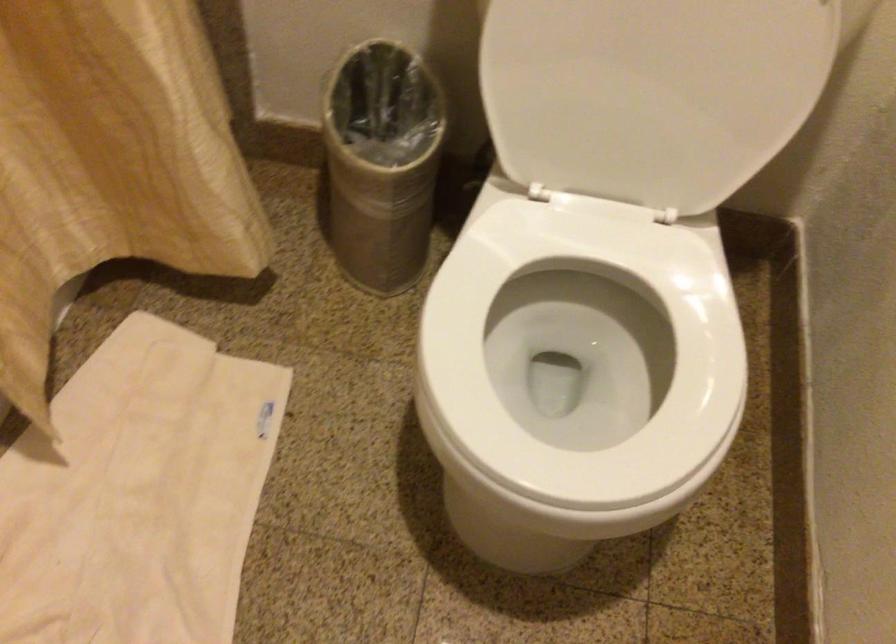
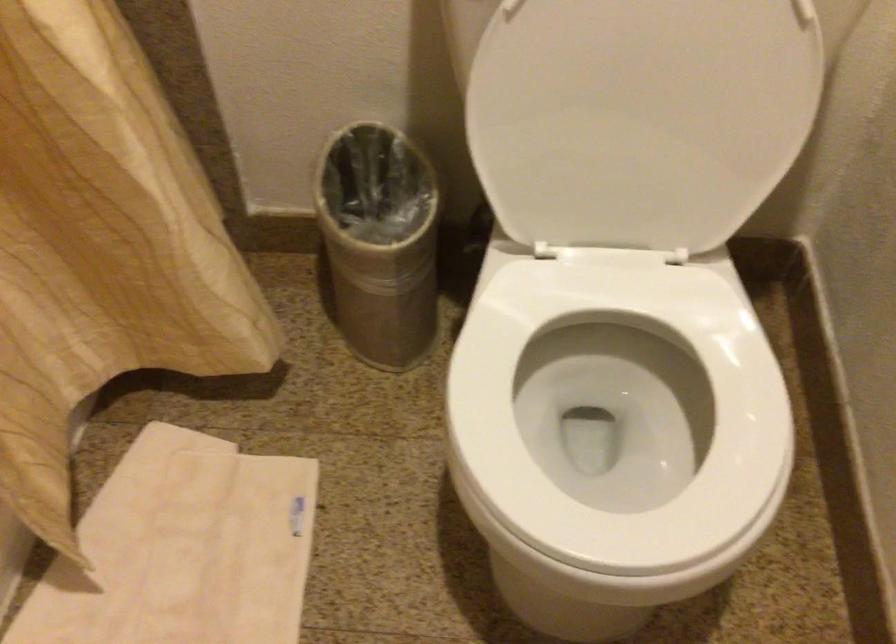
Where in the second image is the point corresponding to the point at 650,71 from the first image?

(640, 118)